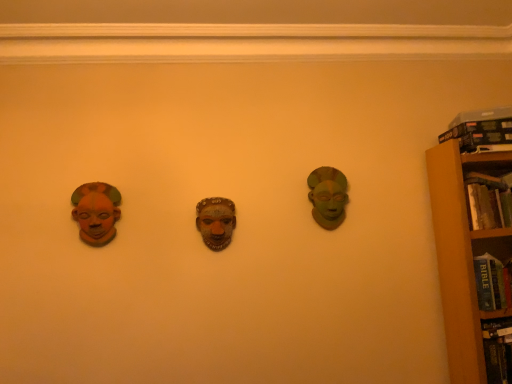
Question: Considering their positions, is matte orange mask at left, the first head in the front-to-back sequence, located in front of or behind hardcover book at upper right, acting as the 2th book starting from the bottom?

Choices:
 (A) behind
 (B) front

Answer: (B)

Question: From a real-world perspective, is matte orange mask at left, acting as the second head starting from the back, above or below hardcover book at upper right, acting as the 2th book starting from the bottom?

Choices:
 (A) below
 (B) above

Answer: (A)

Question: Which of these objects is positioned closest to the green matte mask at center right, which is the first head in right-to-left order?

Choices:
 (A) hardcover book at upper right, the first book positioned from the top
 (B) brown wooden bookcase at right
 (C) matte orange mask at left, acting as the second head starting from the back
 (D) hardcover book at right, arranged as the 1th book when ordered from the bottom

Answer: (B)

Question: Based on their relative distances, which object is farther from the hardcover book at right, arranged as the 1th book when ordered from the bottom?

Choices:
 (A) hardcover book at upper right, acting as the 2th book starting from the bottom
 (B) green matte mask at center right, acting as the 1th head starting from the back
 (C) brown wooden bookcase at right
 (D) matte orange mask at left, the 2th head from the right

Answer: (D)